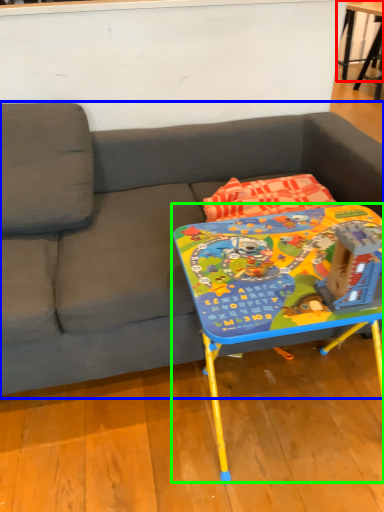
Question: Estimate the real-world distances between objects in this image. Which object is closer to table (highlighted by a red box), studio couch (highlighted by a blue box) or table (highlighted by a green box)?

Choices:
 (A) studio couch
 (B) table

Answer: (A)